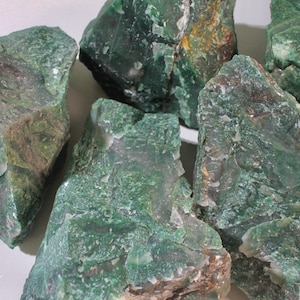
The width and height of the screenshot is (300, 300). In order to click on table in this screenshot , I will do `click(15, 263)`, `click(32, 241)`.